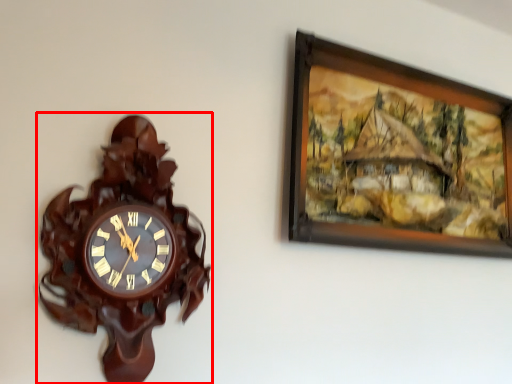
Question: Where is wall clock (annotated by the red box) located in relation to picture frame in the image?

Choices:
 (A) left
 (B) right

Answer: (A)